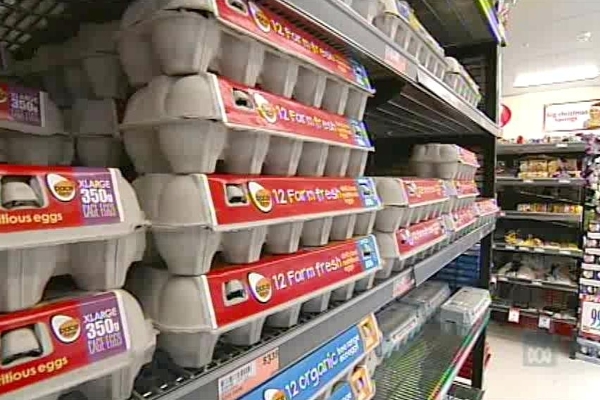
Identify the location of fire alarm. (543, 266), (585, 35).